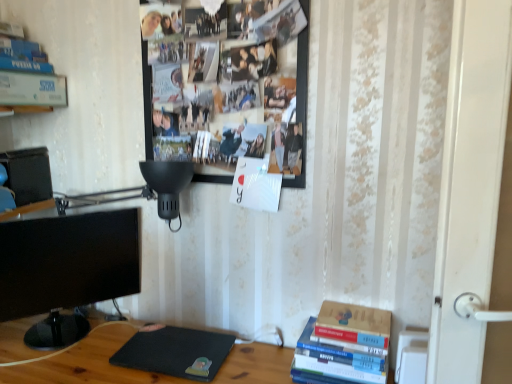
Identify the location of empty space that is ontop of black glossy monitor at left (from a real-world perspective). 53,220.